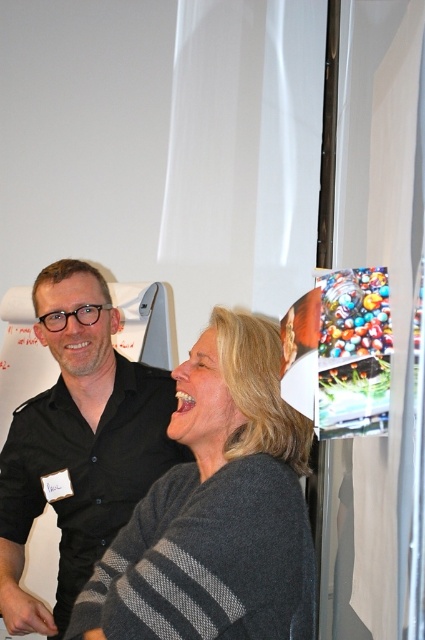
Question: Which of the following is the farthest from the observer?

Choices:
 (A) gray striped sweater at center
 (B) black matte shirt at upper left

Answer: (B)

Question: Which point is closer to the camera taking this photo?

Choices:
 (A) (223, 339)
 (B) (25, 440)

Answer: (A)

Question: Is gray striped sweater at center above black matte shirt at upper left?

Choices:
 (A) yes
 (B) no

Answer: (A)

Question: Can you confirm if gray striped sweater at center is bigger than black matte shirt at upper left?

Choices:
 (A) no
 (B) yes

Answer: (A)

Question: Is gray striped sweater at center in front of black matte shirt at upper left?

Choices:
 (A) no
 (B) yes

Answer: (B)